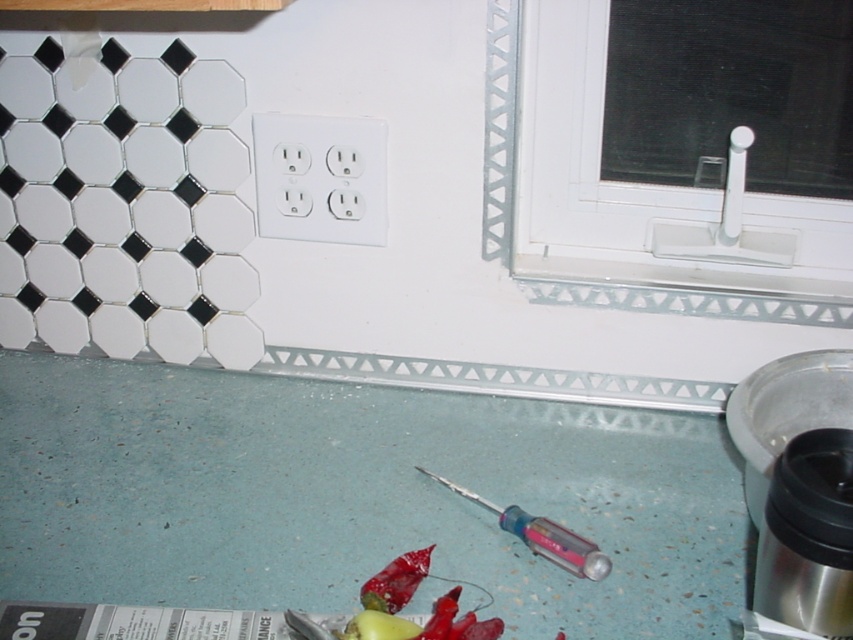
Question: Which point appears closest to the camera in this image?

Choices:
 (A) (828, 356)
 (B) (668, 134)
 (C) (548, 552)

Answer: (C)

Question: Is stainless steel blender at lower right below pink plastic screwdriver at lower center?

Choices:
 (A) no
 (B) yes

Answer: (A)

Question: Which object is the closest to the pink plastic screwdriver at lower center?

Choices:
 (A) blue speckled countertop at lower center
 (B) white plastic window sill at right

Answer: (A)

Question: Which object is closer to the camera taking this photo?

Choices:
 (A) blue speckled countertop at lower center
 (B) pink plastic screwdriver at lower center

Answer: (A)

Question: In this image, where is blue speckled countertop at lower center located relative to white plastic window sill at right?

Choices:
 (A) right
 (B) left

Answer: (B)

Question: From the image, what is the correct spatial relationship of blue speckled countertop at lower center in relation to stainless steel blender at lower right?

Choices:
 (A) right
 (B) left

Answer: (B)